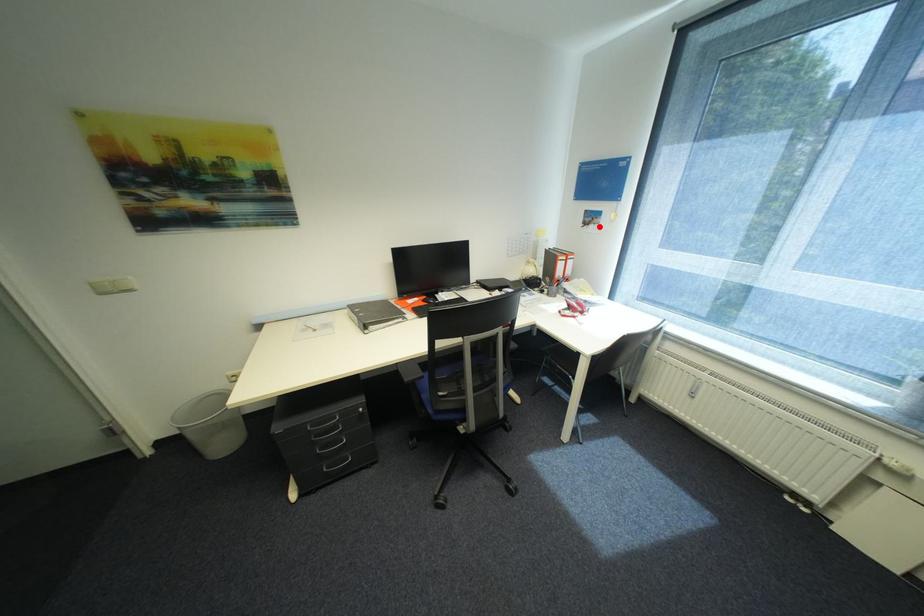
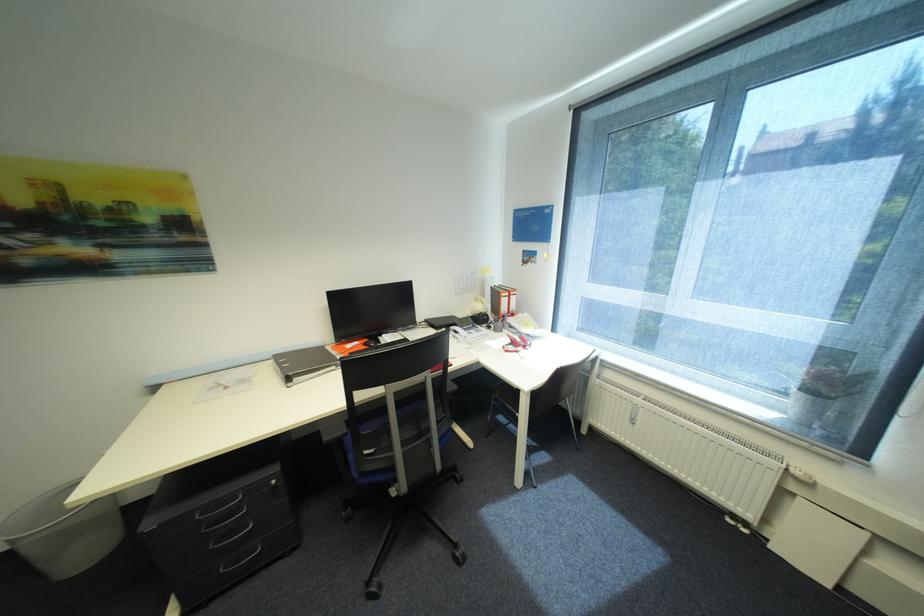
Find the pixel in the second image that matches the highlighted location in the first image.

(537, 265)